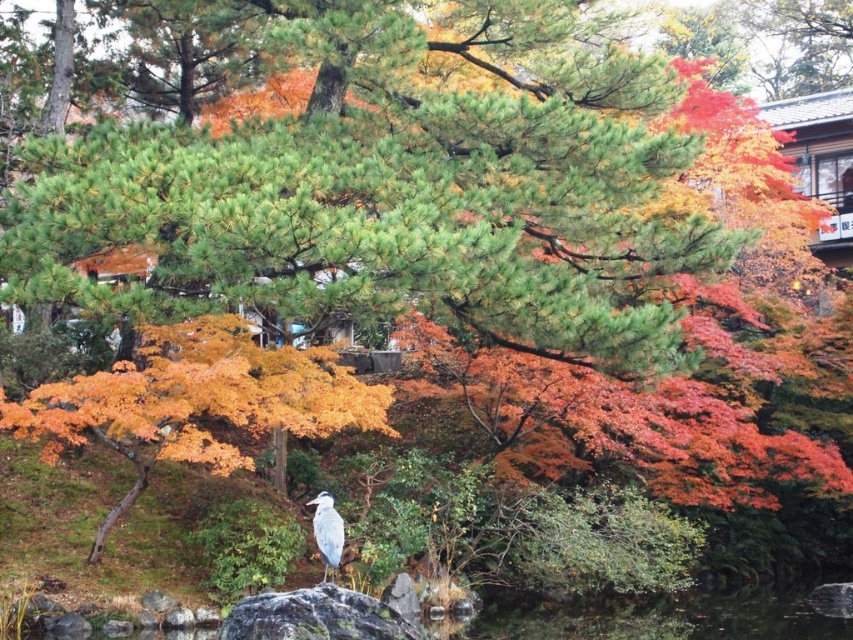
Which is above, orange matte maple at center or white matte bird at center?

orange matte maple at center is above.

Does orange matte maple at center appear on the right side of white matte bird at center?

In fact, orange matte maple at center is to the left of white matte bird at center.

The width and height of the screenshot is (853, 640). Identify the location of orange matte maple at center. (194, 401).

Identify the location of orange matte maple at center. pos(194,401).